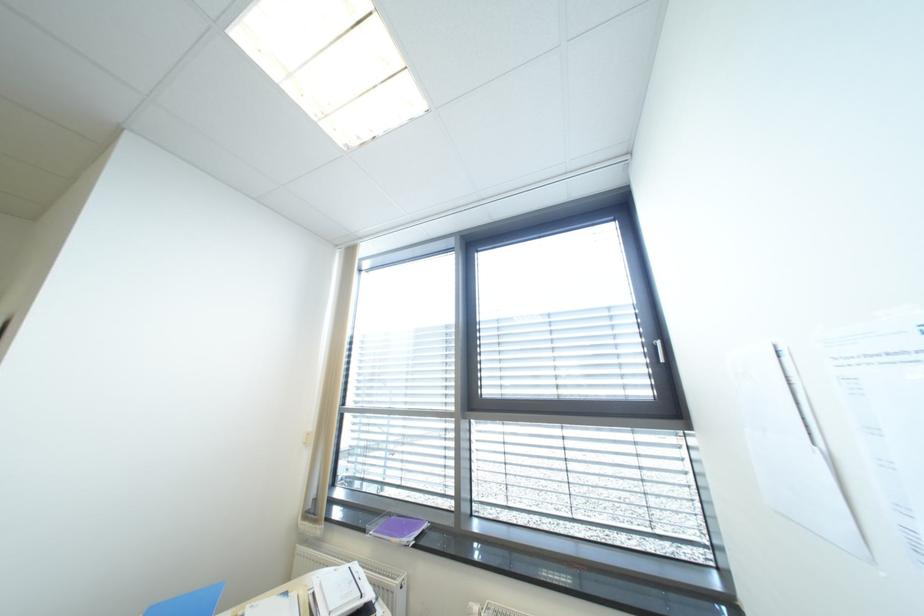
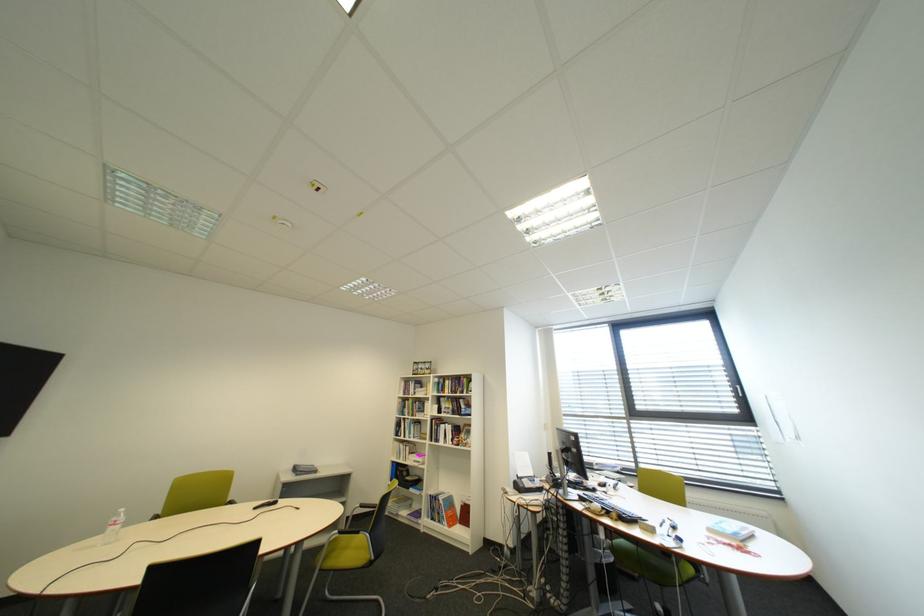
The images are taken continuously from a first-person perspective. In which direction are you moving?

The cameraman moved toward left, backward.